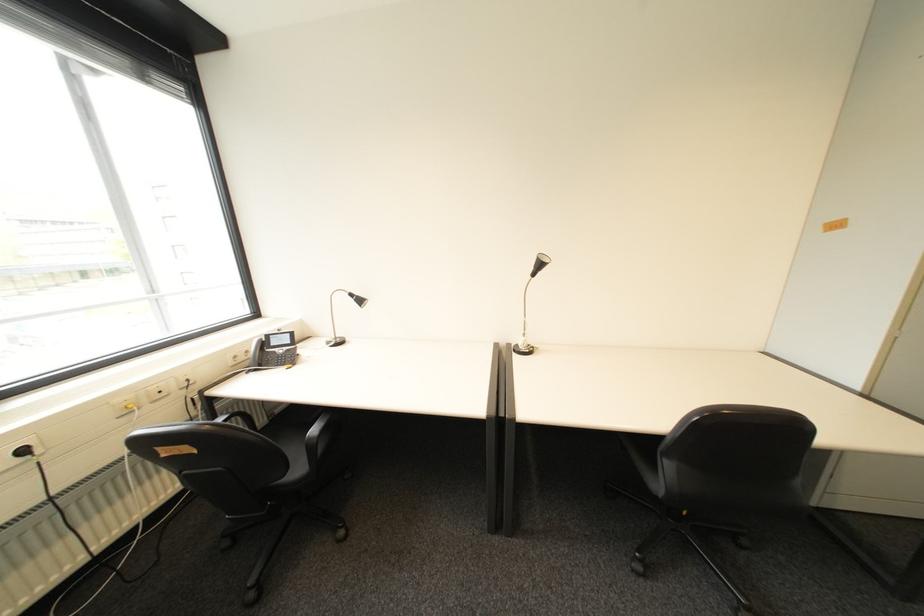
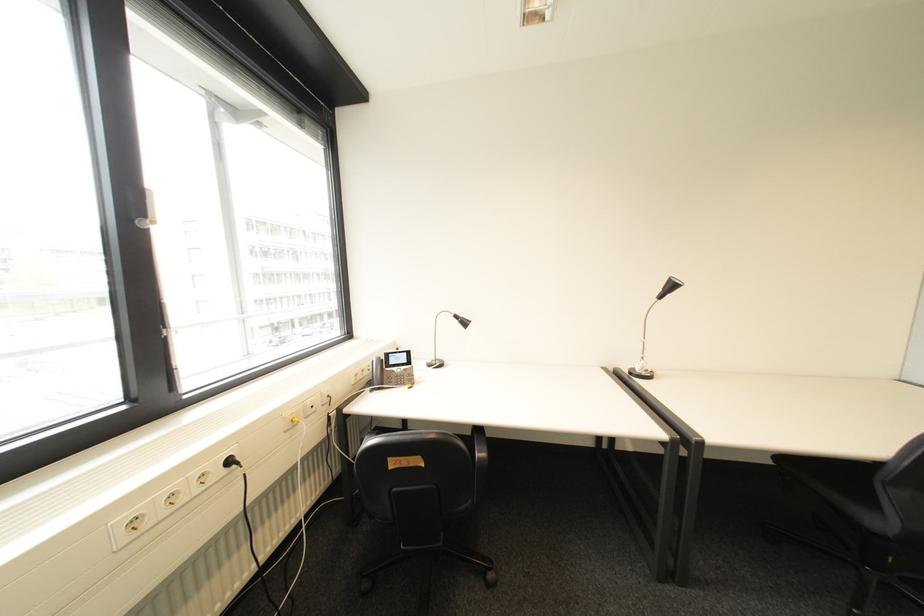
In the second image, find the point that corresponds to (x=34, y=452) in the first image.

(239, 463)